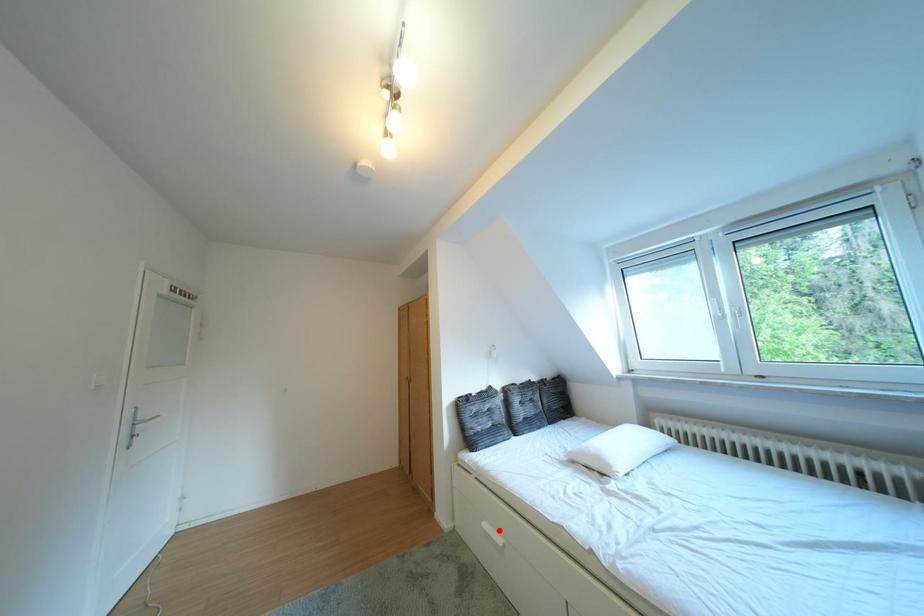
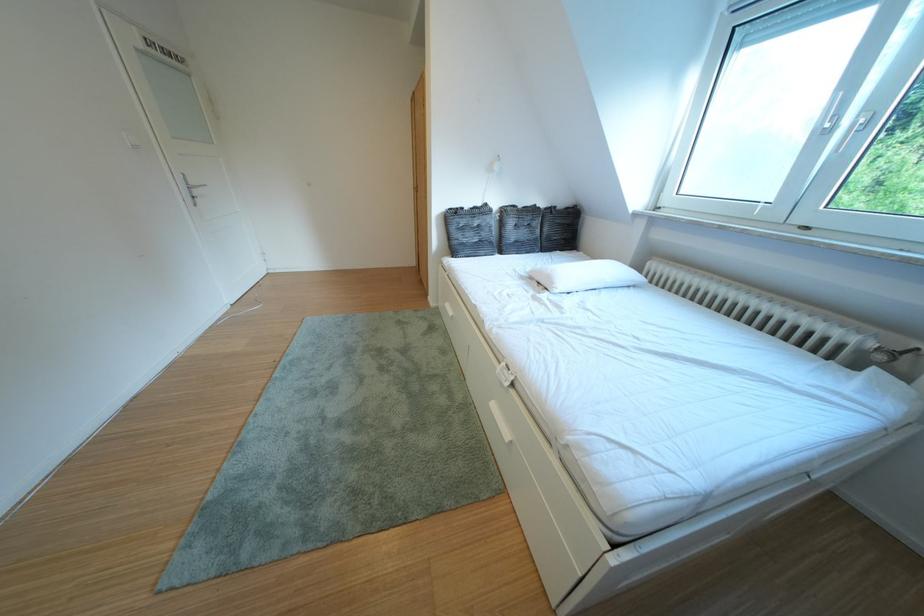
Where in the second image is the point corresponding to the highlighted location from the first image?

(460, 310)